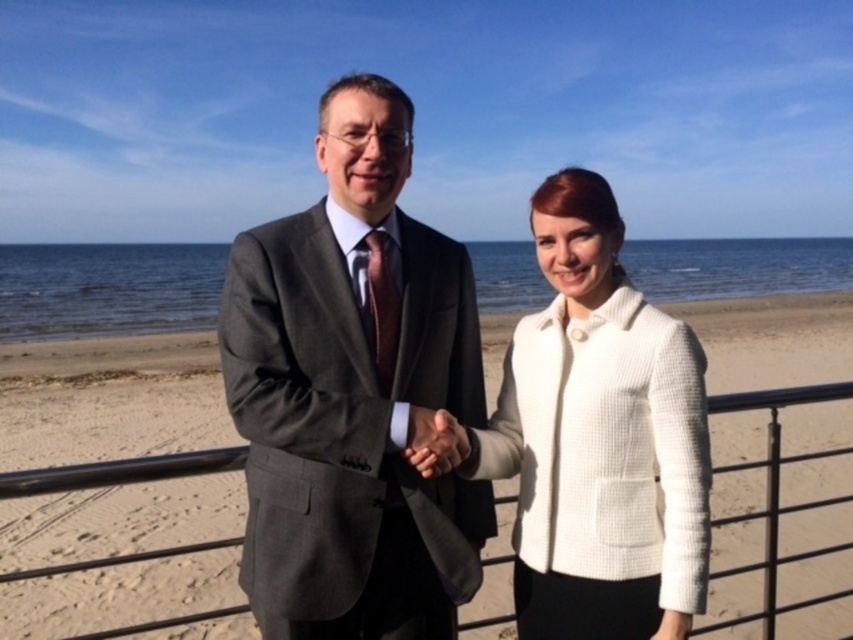
You are a photographer trying to capture the two people in the scene. You notice two points marked in the image. The first point is labeled as point (782, 308) and the second point is labeled as point (457, 448). Which of these points is closer to the camera?

Point (457, 448) is closer to the camera because it is in front of point (782, 308).

You are a photographer at the beach and notice the gray wool suit at center and the white textured jacket at center. Which clothing item is covering part of the other?

The gray wool suit at center is positioned over the white textured jacket at center, so it is covering part of it.